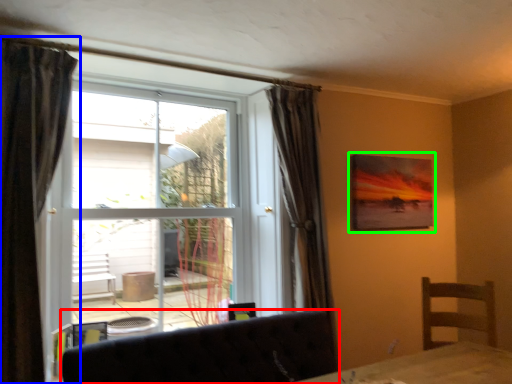
Question: Estimate the real-world distances between objects in this image. Which object is farther from furniture (highlighted by a red box), curtain (highlighted by a blue box) or picture frame (highlighted by a green box)?

Choices:
 (A) curtain
 (B) picture frame

Answer: (B)